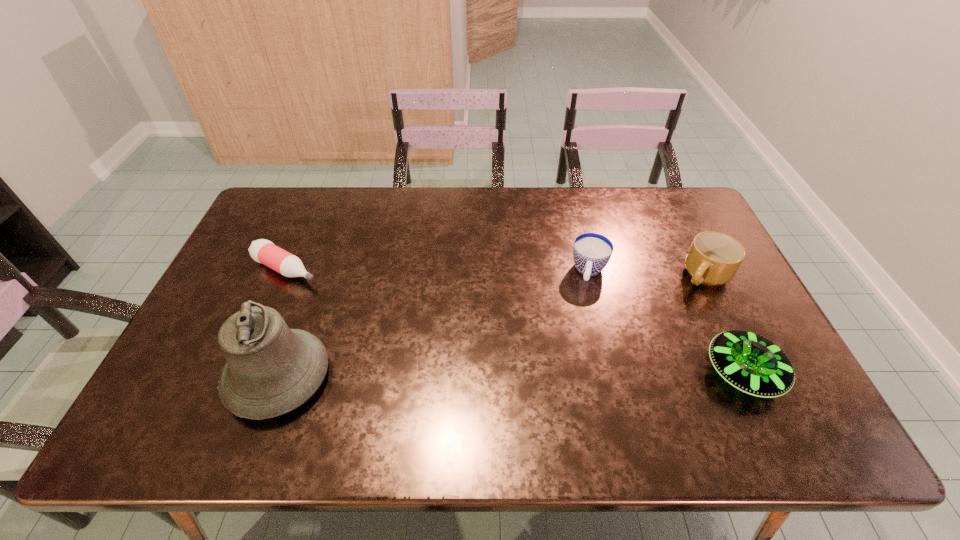
At what (x,y) coordinates should I click in order to perform the action: click on vacant point located on the side of the third object from right to left with the handle. Please return your answer as a coordinate pair (x, y). The image size is (960, 540). Looking at the image, I should click on click(572, 379).

Find the location of a particular element. free space located 0.170m on the side of the third object from right to left with the handle is located at coordinates (580, 334).

Find the location of `blank area located on the side of the third object from right to left with the handle`. blank area located on the side of the third object from right to left with the handle is located at coordinates (586, 303).

I want to click on free location located on the side with the handle of the mug, so click(659, 307).

Find the location of a particular element. vacant space located on the side with the handle of the mug is located at coordinates (635, 324).

Where is `vacant space located 0.300m on the side with the handle of the mug`? vacant space located 0.300m on the side with the handle of the mug is located at coordinates (616, 336).

This screenshot has width=960, height=540. In order to click on bell at the near edge in this screenshot , I will do `click(271, 369)`.

Locate an element on the screen. This screenshot has height=540, width=960. saucer present at the near edge is located at coordinates (751, 363).

Find the location of a particular element. bell present at the left edge is located at coordinates (271, 369).

Identify the location of bottle at the left edge. The width and height of the screenshot is (960, 540). (263, 251).